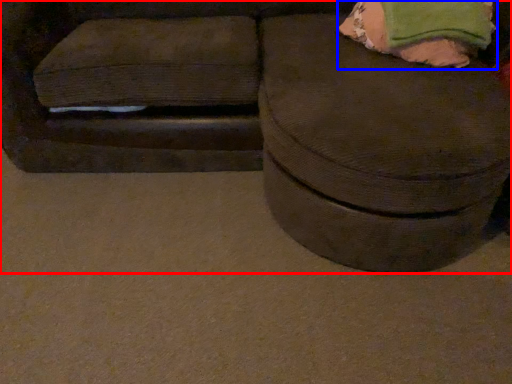
Question: Which object appears farthest to the camera in this image, furniture (highlighted by a red box) or bean bag chair (highlighted by a blue box)?

Choices:
 (A) furniture
 (B) bean bag chair

Answer: (B)